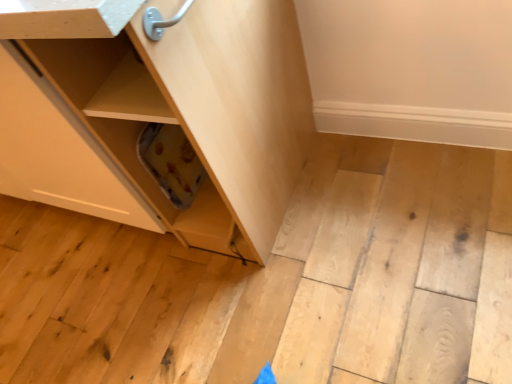
Where is `free location in front of matte wood cabinet at lower left`? free location in front of matte wood cabinet at lower left is located at coordinates (168, 300).